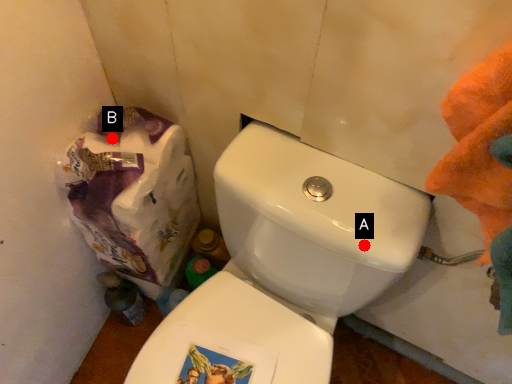
Question: Two points are circled on the image, labeled by A and B beside each circle. Which of the following is the closest to the observer?

Choices:
 (A) A is closer
 (B) B is closer

Answer: (A)